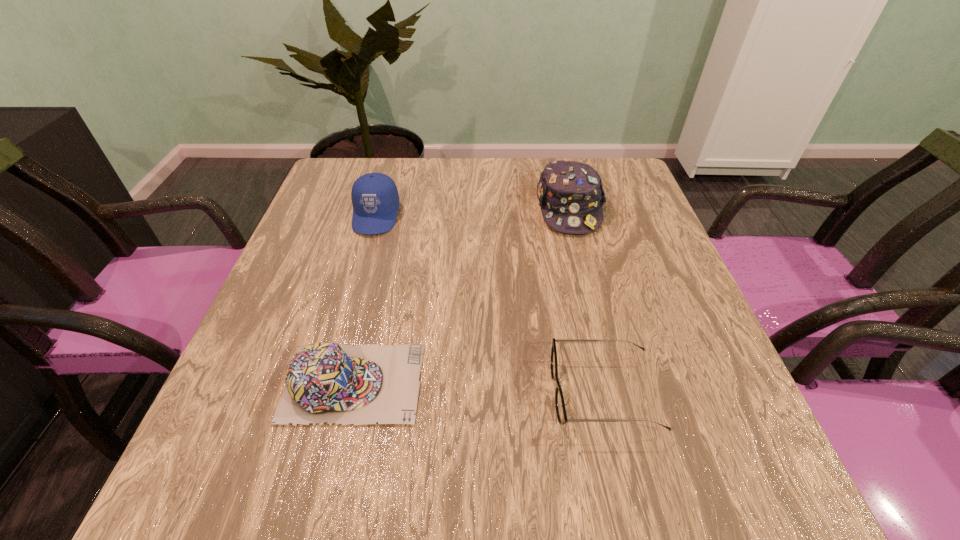
The height and width of the screenshot is (540, 960). What are the coordinates of `free space between the shortest cap and the rightmost cap` in the screenshot? It's located at (461, 296).

At what (x,y) coordinates should I click in order to perform the action: click on free space that is in between the spectacles and the second shortest object. Please return your answer as a coordinate pair (x, y). The image size is (960, 540). Looking at the image, I should click on (x=478, y=388).

You are a GUI agent. You are given a task and a screenshot of the screen. Output one action in this format:
    pyautogui.click(x=<x>, y=<y>)
    Task: Click on the empty space that is in between the shortest object and the second shortest object
    Image resolution: width=960 pixels, height=540 pixels.
    Given the screenshot: What is the action you would take?
    coord(478,388)

Locate an element on the screen. The height and width of the screenshot is (540, 960). vacant space that's between the nearest cap and the rightmost cap is located at coordinates (461, 296).

The image size is (960, 540). In order to click on object that stands as the third closest to the shortest cap in this screenshot , I will do `click(570, 194)`.

At what (x,y) coordinates should I click in order to perform the action: click on object that is the third nearest to the nearest cap. Please return your answer as a coordinate pair (x, y). This screenshot has height=540, width=960. Looking at the image, I should click on (570, 194).

Select which cap is the closest to the second shortest object. Please provide its 2D coordinates. Your answer should be formatted as a tuple, i.e. [(x, y)], where the tuple contains the x and y coordinates of a point satisfying the conditions above.

[(375, 198)]

I want to click on the second closest cap to the spectacles, so click(570, 194).

At what (x,y) coordinates should I click in order to perform the action: click on blank space that satisfies the following two spatial constraints: 1. on the front-facing side of the rightmost cap; 2. through the lenses of the shortest object. Please return your answer as a coordinate pair (x, y). The height and width of the screenshot is (540, 960). Looking at the image, I should click on (614, 393).

Locate an element on the screen. vacant space that satisfies the following two spatial constraints: 1. on the front-facing side of the rightmost cap; 2. through the lenses of the shortest object is located at coordinates (614, 393).